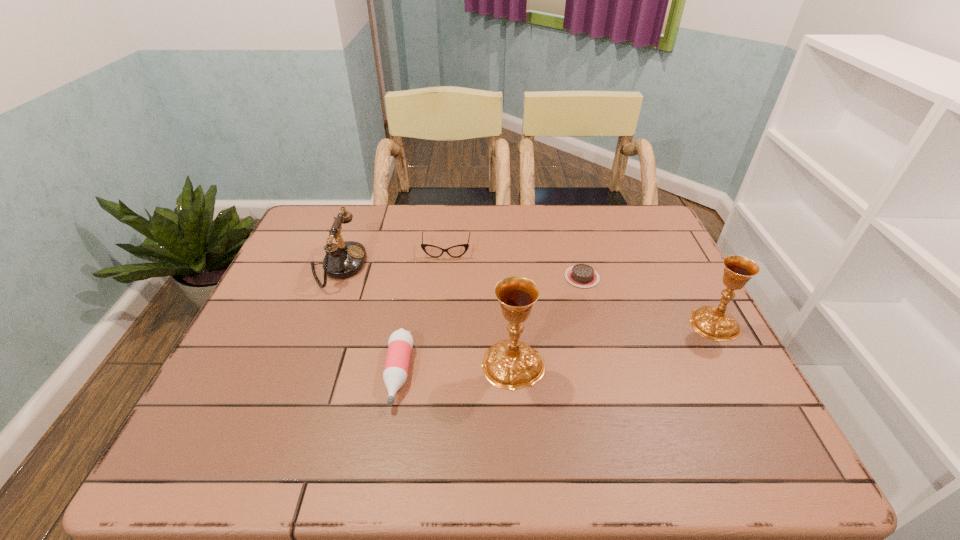
Locate an element on the screen. The image size is (960, 540). object positioned at the right edge is located at coordinates (711, 322).

Image resolution: width=960 pixels, height=540 pixels. Identify the location of object at the far left corner. (342, 260).

Find the location of a particular element. vacant position at the far edge of the desktop is located at coordinates (378, 210).

Identify the location of vacant region at the near edge of the desktop. Image resolution: width=960 pixels, height=540 pixels. (513, 404).

In the image, there is a desktop. At what (x,y) coordinates should I click in order to perform the action: click on free space at the left edge. Please return your answer as a coordinate pair (x, y). The height and width of the screenshot is (540, 960). Looking at the image, I should click on (287, 383).

The width and height of the screenshot is (960, 540). In order to click on vacant space at the right edge in this screenshot , I will do `click(686, 306)`.

Identify the location of free region at the far left corner. (356, 212).

Find the location of `vacant space at the far right corner`. vacant space at the far right corner is located at coordinates pyautogui.click(x=651, y=210).

In the image, there is a desktop. At what (x,y) coordinates should I click in order to perform the action: click on free space at the near right corner. Please return your answer as a coordinate pair (x, y). Looking at the image, I should click on (735, 418).

Where is `free space between the shorter chalice and the fifth object from left to right`? Image resolution: width=960 pixels, height=540 pixels. free space between the shorter chalice and the fifth object from left to right is located at coordinates (648, 300).